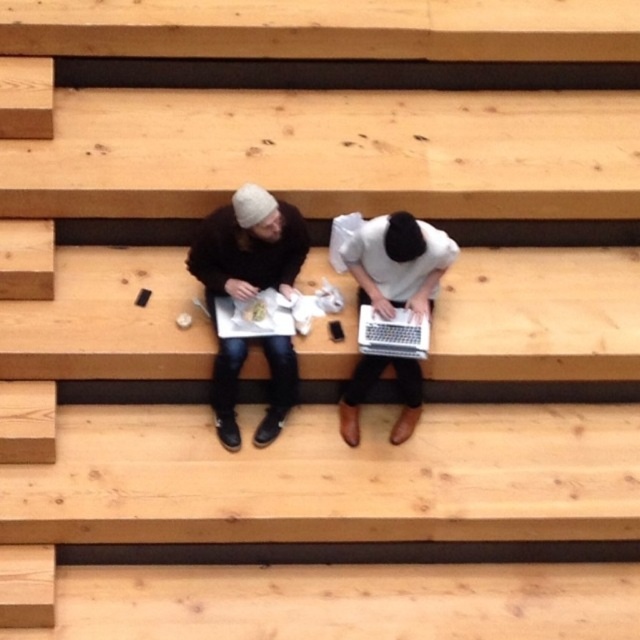
How far apart are matte black jacket at center and white matte laptop at center?

matte black jacket at center and white matte laptop at center are 23.73 inches apart.

Find the location of a particular element. Image resolution: width=640 pixels, height=640 pixels. matte black jacket at center is located at coordinates (248, 248).

Locate an element on the screen. This screenshot has height=640, width=640. matte black jacket at center is located at coordinates (248, 248).

From the picture: Which is above, white matte laptop at center or silver metallic laptop at center?

white matte laptop at center is higher up.

Does point (365, 262) lie behind point (385, 353)?

That is True.

Describe the element at coordinates (397, 262) in the screenshot. The width and height of the screenshot is (640, 640). I see `white matte laptop at center` at that location.

Image resolution: width=640 pixels, height=640 pixels. Identify the location of white matte laptop at center. (397, 262).

Who is lower down, matte black jacket at center or silver metallic laptop at center?

silver metallic laptop at center

Does matte black jacket at center have a greater width compared to silver metallic laptop at center?

Yes.

Is point (204, 272) positioned before point (420, 323)?

That is False.

Locate an element on the screen. The image size is (640, 640). matte black jacket at center is located at coordinates (248, 248).